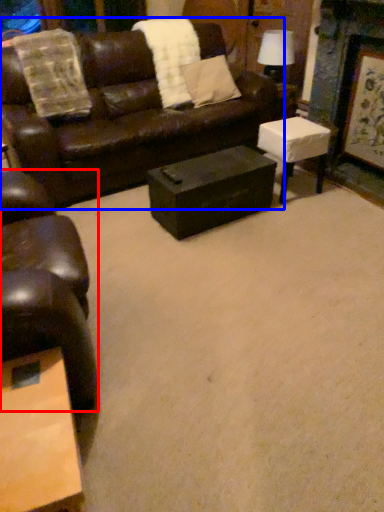
Question: Which object appears closest to the camera in this image, chair (highlighted by a red box) or studio couch (highlighted by a blue box)?

Choices:
 (A) chair
 (B) studio couch

Answer: (A)